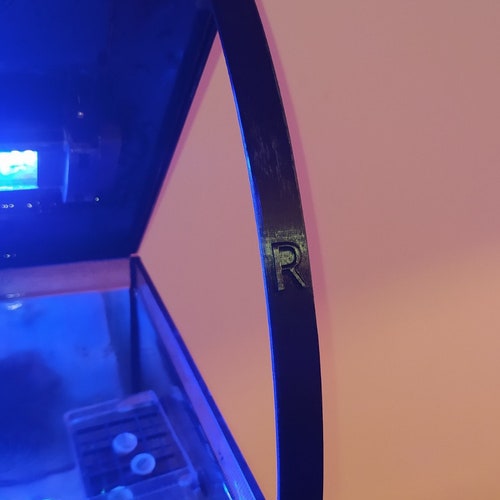
Find the location of `pink wall`. pink wall is located at coordinates (383, 259).